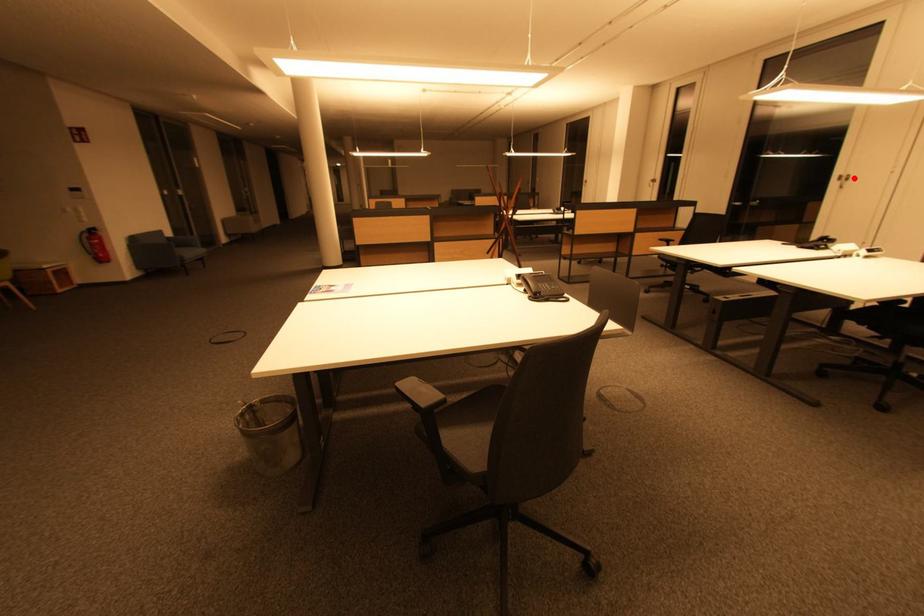
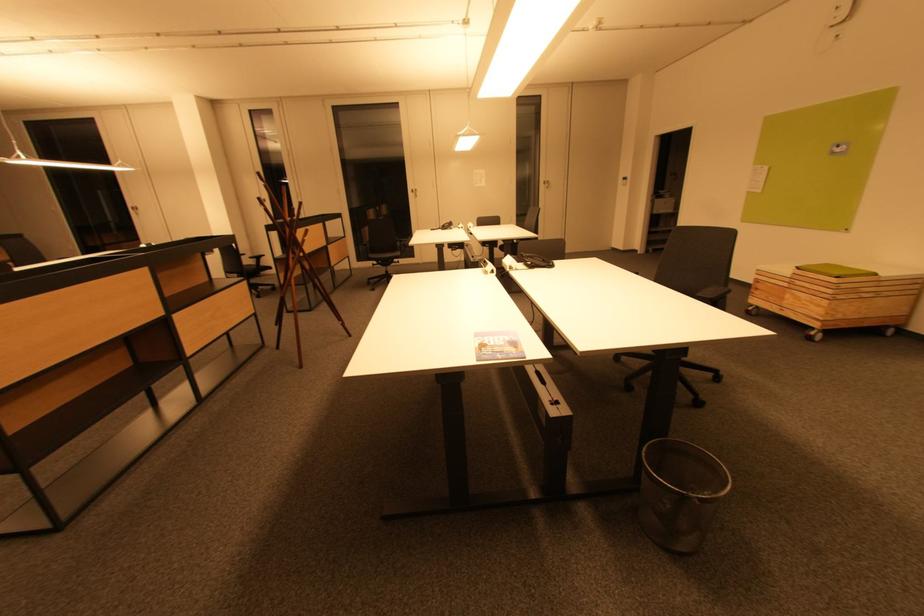
Question: I am providing you with two images of the same scene from different viewpoints. Image1 has a red point marked. In image2, the corresponding 3D location appears at what relative position? Reply with the corresponding letter.

Choices:
 (A) Closer
 (B) Farther

Answer: (A)